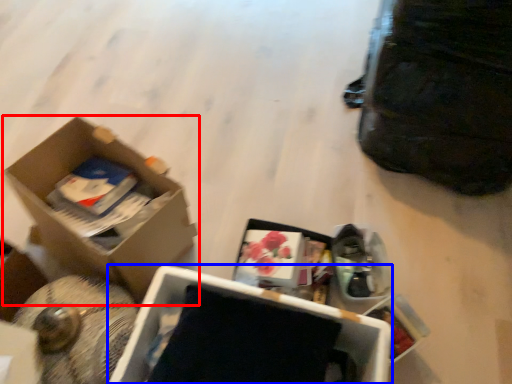
Question: Among these objects, which one is farthest to the camera, box (highlighted by a red box) or box (highlighted by a blue box)?

Choices:
 (A) box
 (B) box

Answer: (A)